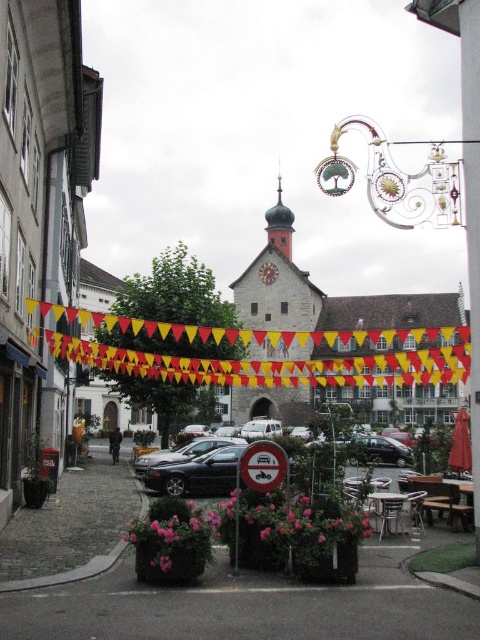
Does shiny black sedan at center appear under red plastic sign at center?

Yes.

Who is lower down, shiny black sedan at center or red plastic sign at center?

shiny black sedan at center is lower down.

Locate an element on the screen. The width and height of the screenshot is (480, 640). shiny black sedan at center is located at coordinates (194, 476).

Is point (233, 474) less distant than point (239, 477)?

No, it is behind (239, 477).

Which is in front, point (197, 470) or point (269, 451)?

Point (269, 451) is in front.

Identify the location of shiny black car at center. Image resolution: width=480 pixels, height=640 pixels. (196, 474).

Can you confirm if shiny black sedan at center is taller than shiny black car at center?

Indeed, shiny black sedan at center has a greater height compared to shiny black car at center.

Measure the distance between shiny black sedan at center and shiny black car at center.

shiny black sedan at center is 5.77 meters away from shiny black car at center.

Find the location of a particular element. shiny black sedan at center is located at coordinates (194, 476).